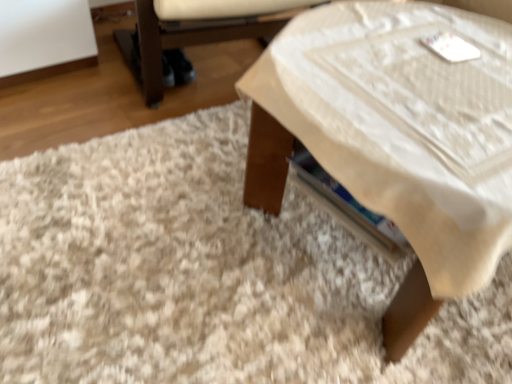
Question: Considering the relative sizes of white shaggy rug at lower left and white fabric armchair at lower right in the image provided, is white shaggy rug at lower left wider than white fabric armchair at lower right?

Choices:
 (A) no
 (B) yes

Answer: (B)

Question: Does white shaggy rug at lower left contain white fabric armchair at lower right?

Choices:
 (A) yes
 (B) no

Answer: (B)

Question: From the image's perspective, is white shaggy rug at lower left on white fabric armchair at lower right?

Choices:
 (A) no
 (B) yes

Answer: (A)

Question: Is white shaggy rug at lower left to the right of white fabric armchair at lower right from the viewer's perspective?

Choices:
 (A) yes
 (B) no

Answer: (A)

Question: Is white shaggy rug at lower left bigger than white fabric armchair at lower right?

Choices:
 (A) no
 (B) yes

Answer: (A)

Question: Does point (156, 91) appear closer or farther from the camera than point (283, 99)?

Choices:
 (A) closer
 (B) farther

Answer: (B)

Question: Is white fabric armchair at lower right situated inside wooden table at center or outside?

Choices:
 (A) inside
 (B) outside

Answer: (B)

Question: Is white fabric armchair at lower right in front of or behind wooden table at center in the image?

Choices:
 (A) front
 (B) behind

Answer: (B)

Question: From the image's perspective, relative to wooden table at center, is white fabric armchair at lower right above or below?

Choices:
 (A) above
 (B) below

Answer: (A)

Question: Visually, is white shaggy rug at lower left positioned to the left or to the right of white fabric armchair at lower right?

Choices:
 (A) left
 (B) right

Answer: (B)

Question: From the image's perspective, is white shaggy rug at lower left located above or below white fabric armchair at lower right?

Choices:
 (A) above
 (B) below

Answer: (B)

Question: Would you say white shaggy rug at lower left is inside or outside white fabric armchair at lower right?

Choices:
 (A) inside
 (B) outside

Answer: (B)

Question: Considering their positions, is white shaggy rug at lower left located in front of or behind white fabric armchair at lower right?

Choices:
 (A) behind
 (B) front

Answer: (B)

Question: Is point tap(373, 132) positioned closer to the camera than point tap(343, 344)?

Choices:
 (A) closer
 (B) farther

Answer: (A)

Question: Relative to white shaggy rug at lower left, is wooden table at center in front or behind?

Choices:
 (A) behind
 (B) front

Answer: (B)